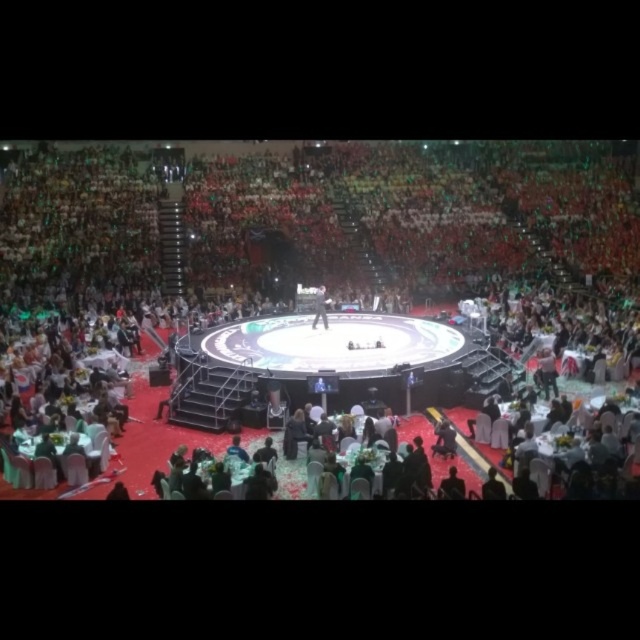
Question: Can you confirm if black glossy microphone at center is positioned to the right of black fabric person at center?

Choices:
 (A) yes
 (B) no

Answer: (A)

Question: Which point appears closest to the camera in this image?

Choices:
 (A) (324, 307)
 (B) (468, 312)

Answer: (A)

Question: Which of the following is the closest to the observer?

Choices:
 (A) black fabric person at center
 (B) black glossy microphone at center

Answer: (B)

Question: Is black glossy microphone at center closer to the viewer compared to black fabric person at center?

Choices:
 (A) yes
 (B) no

Answer: (A)

Question: Is black glossy microphone at center below black fabric person at center?

Choices:
 (A) no
 (B) yes

Answer: (A)